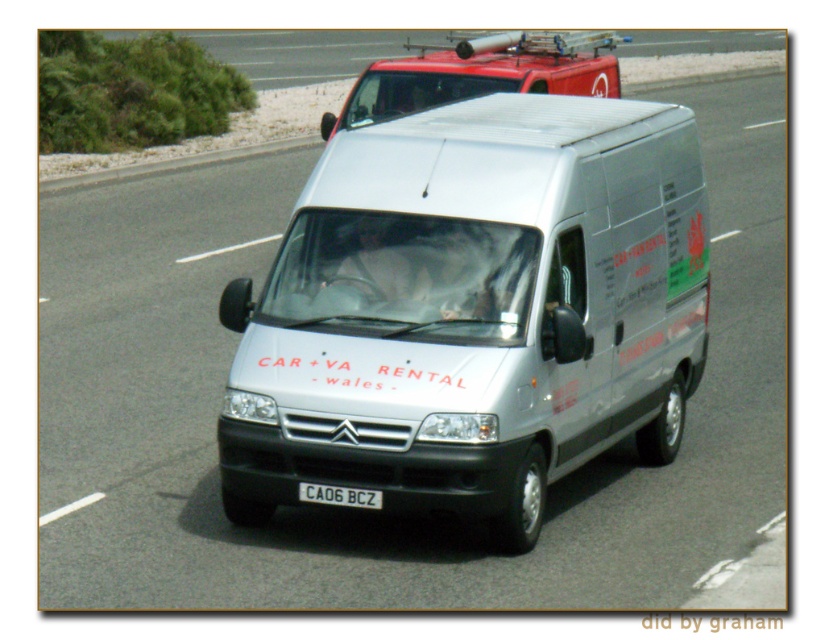
Question: Estimate the real-world distances between objects in this image. Which object is farther from the red matte van at upper center?

Choices:
 (A) white matte van at center
 (B) black plastic license plate at center

Answer: (B)

Question: Does white matte van at center appear on the right side of red matte van at upper center?

Choices:
 (A) no
 (B) yes

Answer: (B)

Question: Can you confirm if red matte van at upper center is thinner than black plastic license plate at center?

Choices:
 (A) yes
 (B) no

Answer: (B)

Question: Which object is closer to the camera taking this photo?

Choices:
 (A) white matte van at center
 (B) red matte van at upper center
 (C) black plastic license plate at center

Answer: (A)

Question: Can you confirm if white matte van at center is positioned to the right of red matte van at upper center?

Choices:
 (A) yes
 (B) no

Answer: (A)

Question: Which of these objects is positioned farthest from the white matte van at center?

Choices:
 (A) black plastic license plate at center
 (B) red matte van at upper center

Answer: (B)